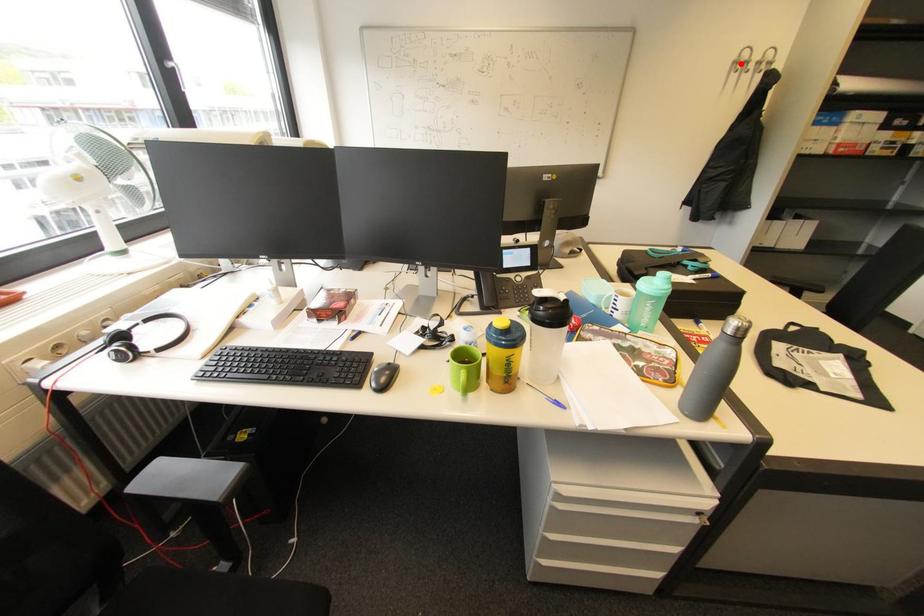
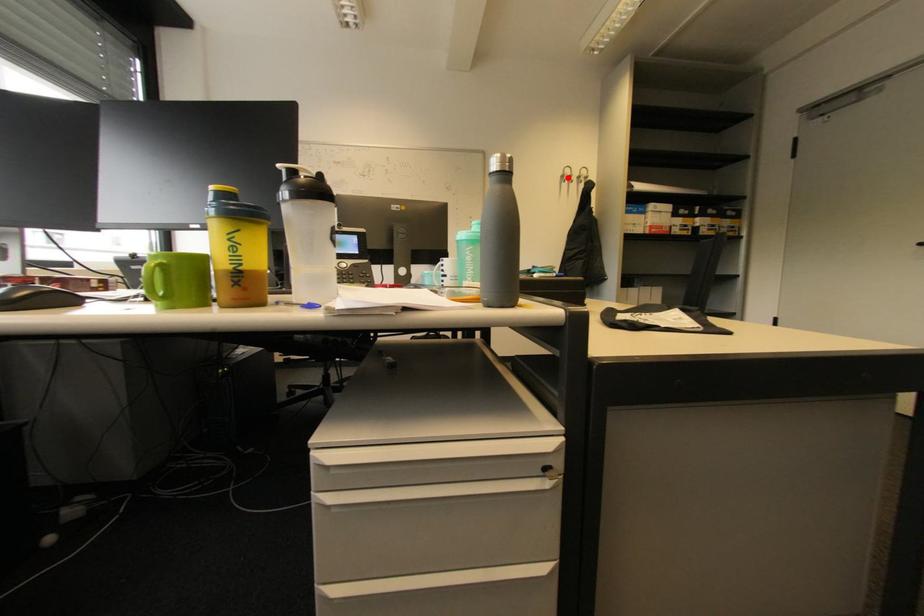
I am providing you with two images of the same scene from different viewpoints. A red point is marked on the first image and another point is marked on the second image. Does the point marked in image1 correspond to the same location as the one in image2?

Yes